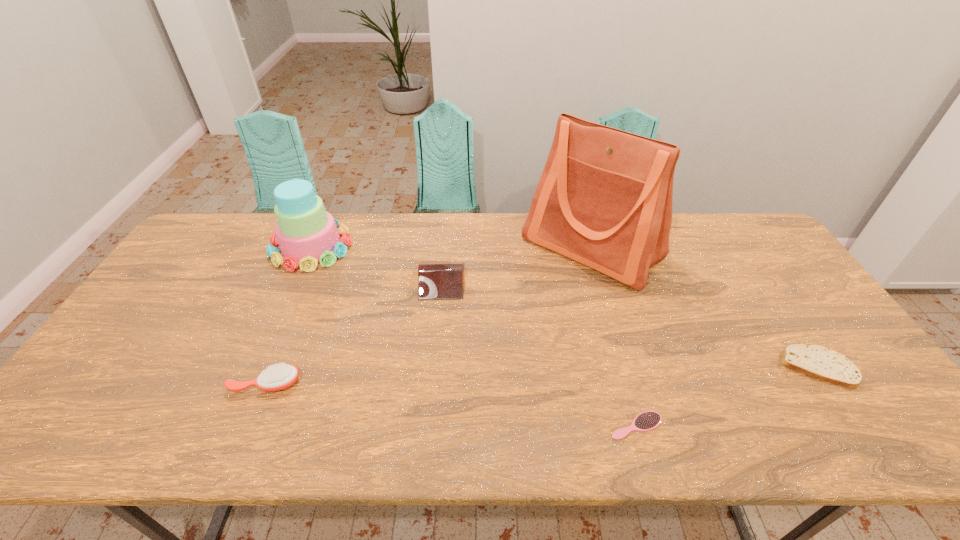
Where is `vacant region located 0.080m on the left of the tallest object`? This screenshot has width=960, height=540. vacant region located 0.080m on the left of the tallest object is located at coordinates (498, 248).

Find the location of a particular element. The width and height of the screenshot is (960, 540). free space located 0.270m on the right of the fifth shortest object is located at coordinates (433, 247).

Identify the location of free space located 0.060m on the left of the book. The image size is (960, 540). (400, 280).

The width and height of the screenshot is (960, 540). In order to click on vacant position located on the right of the third shortest object in this screenshot , I will do `click(398, 383)`.

Where is `vacant space located on the front of the pita bread`? The width and height of the screenshot is (960, 540). vacant space located on the front of the pita bread is located at coordinates (868, 445).

At what (x,y) coordinates should I click in order to perform the action: click on free region located 0.070m on the left of the shorter hairbrush. Please return your answer as a coordinate pair (x, y). Looking at the image, I should click on (578, 426).

Image resolution: width=960 pixels, height=540 pixels. What are the coordinates of `shopping bag present at the far edge` in the screenshot? It's located at (604, 199).

At what (x,y) coordinates should I click in order to perform the action: click on cake at the far edge. Please return your answer as a coordinate pair (x, y). The height and width of the screenshot is (540, 960). Looking at the image, I should click on (307, 234).

Find the location of a particular element. This screenshot has width=960, height=540. object at the near edge is located at coordinates (646, 421).

Find the location of `object that is at the right edge`. object that is at the right edge is located at coordinates (816, 361).